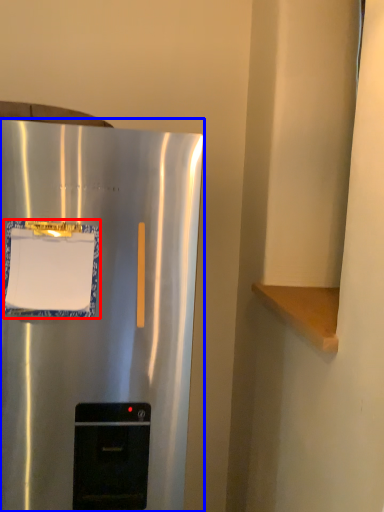
Question: Among these objects, which one is nearest to the camera, paper (highlighted by a red box) or refrigerator (highlighted by a blue box)?

Choices:
 (A) paper
 (B) refrigerator

Answer: (B)